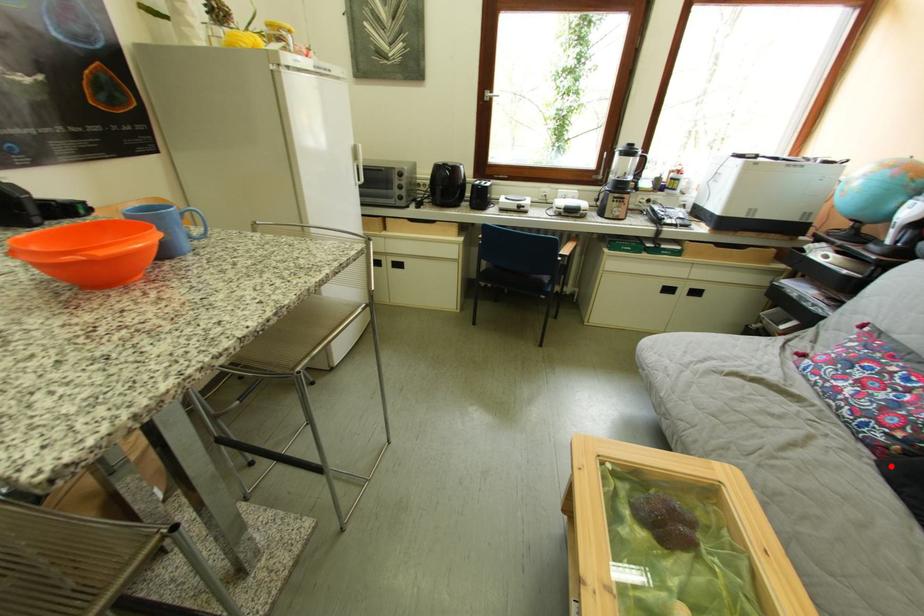
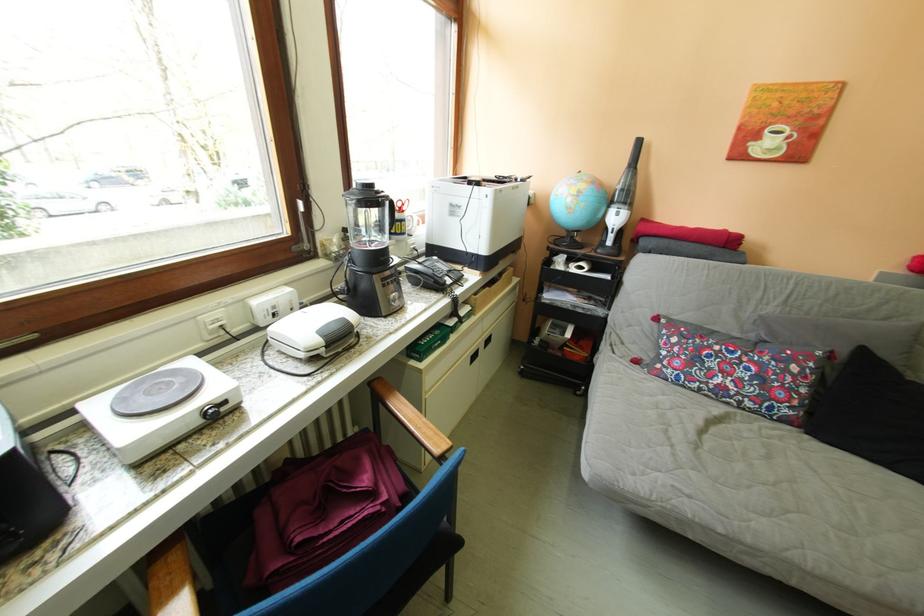
Locate, in the second image, the point that corresponds to the highlighted location in the first image.

(821, 437)